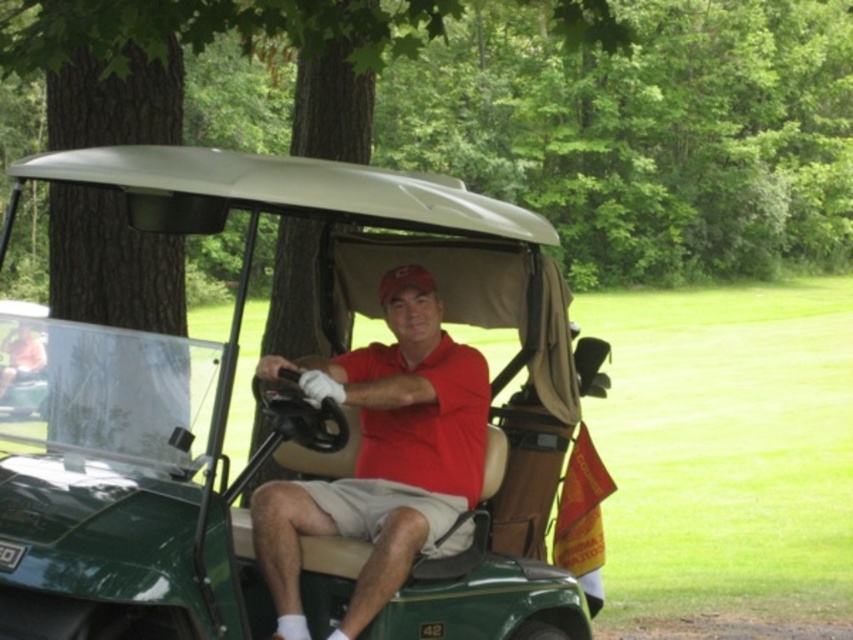
Does green matte golf cart at center appear on the left side of matte red shirt at center?

Yes, green matte golf cart at center is to the left of matte red shirt at center.

Which is in front, point (218, 573) or point (408, 563)?

Point (218, 573)

In order to click on green matte golf cart at center in this screenshot , I will do `click(271, 412)`.